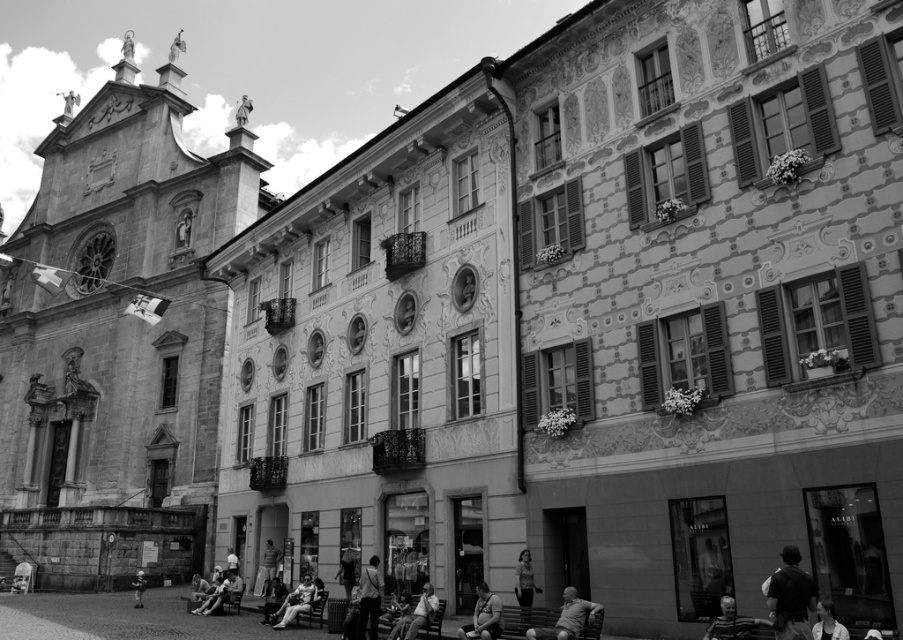
Between light brown leather jacket at center and light gray fabric jacket at lower center, which one is positioned lower?

light gray fabric jacket at lower center

Based on the photo, can you confirm if light brown leather jacket at center is smaller than light gray fabric jacket at lower center?

No, light brown leather jacket at center is not smaller than light gray fabric jacket at lower center.

This screenshot has width=903, height=640. I want to click on light brown leather jacket at center, so click(x=368, y=600).

Identify the location of light brown leather jacket at center. The width and height of the screenshot is (903, 640). (368, 600).

Which of these two, matte black jacket at lower center or smooth skin person at lower center, stands taller?

Standing taller between the two is matte black jacket at lower center.

Does matte black jacket at lower center have a lesser width compared to smooth skin person at lower center?

Yes, matte black jacket at lower center is thinner than smooth skin person at lower center.

Is point (473, 621) less distant than point (227, 573)?

Yes, it is.

Find the location of a particular element. Image resolution: width=903 pixels, height=640 pixels. matte black jacket at lower center is located at coordinates (483, 616).

Can you confirm if smooth gray shirt at lower center is smaller than smooth leather jacket at center?

Actually, smooth gray shirt at lower center might be larger than smooth leather jacket at center.

Does smooth gray shirt at lower center have a larger size compared to smooth leather jacket at center?

Correct, smooth gray shirt at lower center is larger in size than smooth leather jacket at center.

Between point (733, 609) and point (420, 627), which one is positioned in front?

Point (733, 609)

The image size is (903, 640). Find the location of `smooth gray shirt at lower center`. smooth gray shirt at lower center is located at coordinates (732, 621).